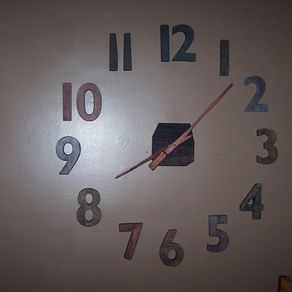
Identify the location of hour hand of clock. This screenshot has width=292, height=292. (137, 164).